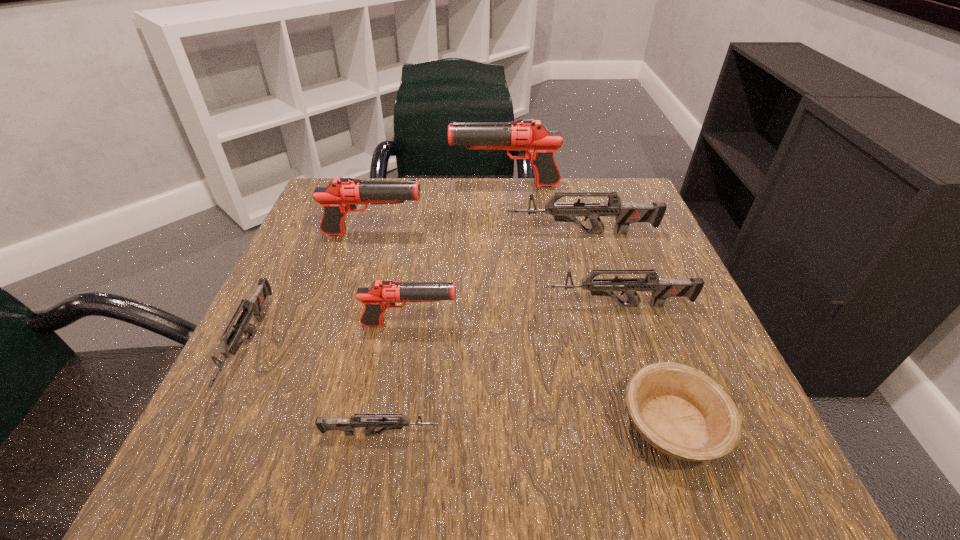
You are a GUI agent. You are given a task and a screenshot of the screen. Output one action in this format:
    pyautogui.click(x=<x>, y=<y>)
    Task: Click on the free location located 0.150m aimed along the barrel of the farthest grey gun
    The height and width of the screenshot is (540, 960).
    Given the screenshot: What is the action you would take?
    pyautogui.click(x=437, y=233)

I want to click on blank area located aimed along the barrel of the third smallest grey gun, so click(x=385, y=306).

This screenshot has width=960, height=540. Identify the location of vacant space located aimed along the barrel of the third smallest grey gun. (514, 306).

At what (x,y) coordinates should I click in order to perform the action: click on vacant space located aimed along the barrel of the third smallest grey gun. Please return your answer as a coordinate pair (x, y). Looking at the image, I should click on click(436, 306).

At what (x,y) coordinates should I click in order to perform the action: click on free spot located 0.080m aimed along the barrel of the third shortest object. Please return your answer as a coordinate pair (x, y). This screenshot has width=960, height=540. Looking at the image, I should click on (194, 454).

Locate an element on the screen. This screenshot has width=960, height=540. vacant point located 0.160m aimed along the barrel of the nearest gun is located at coordinates (556, 434).

At what (x,y) coordinates should I click in order to perform the action: click on free spot located 0.120m on the back of the beige bowl. Please return your answer as a coordinate pair (x, y). Looking at the image, I should click on (636, 322).

This screenshot has width=960, height=540. Identify the location of gun that is at the near edge. pos(348,425).

The height and width of the screenshot is (540, 960). In order to click on bowl that is positioned at the near edge in this screenshot , I will do `click(682, 412)`.

Where is `bowl at the right edge`? bowl at the right edge is located at coordinates coord(682,412).